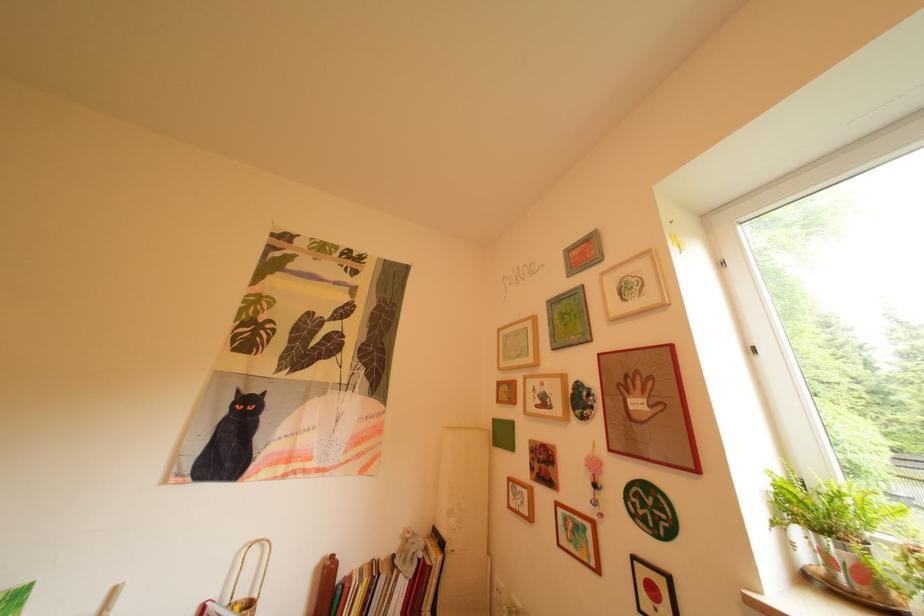
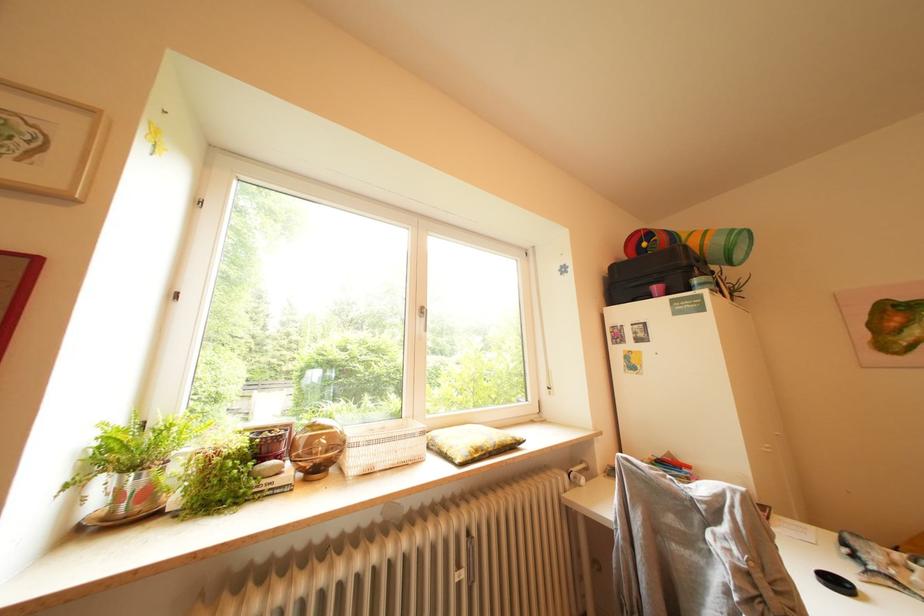
Question: The camera is either moving clockwise (left) or counter-clockwise (right) around the object. The first image is from the beginning of the video and the second image is from the end. Is the camera moving left or right when shooting the video?

Choices:
 (A) Left
 (B) Right

Answer: (A)